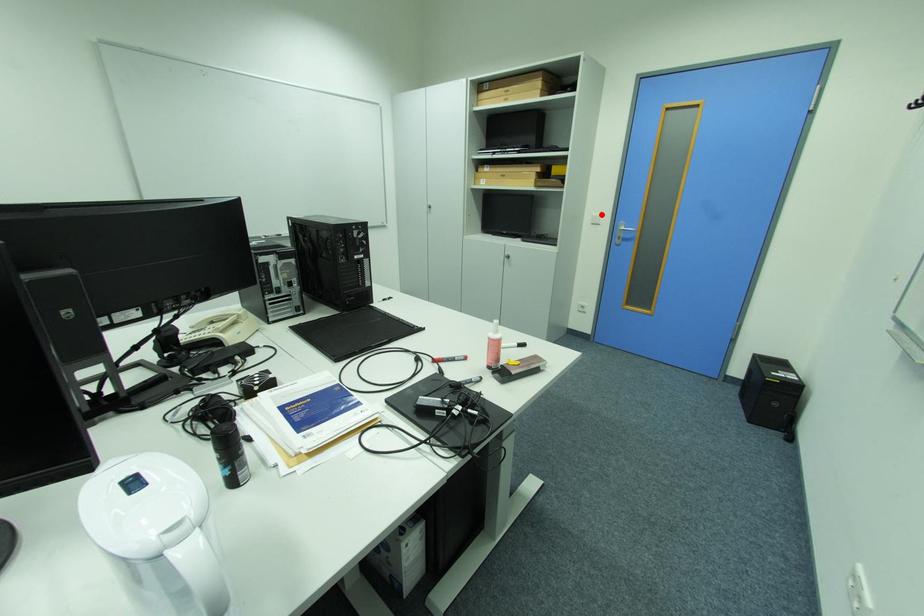
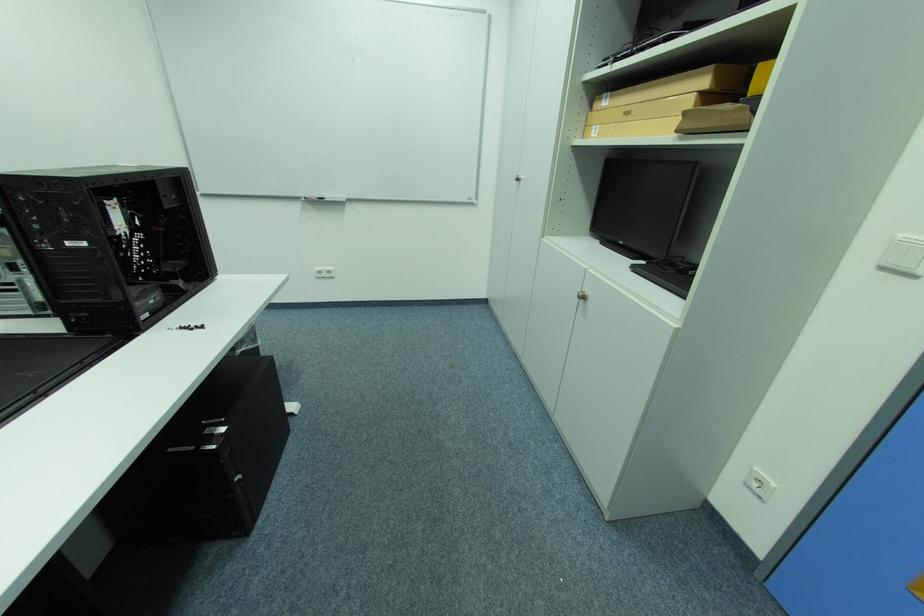
Locate, in the second image, the point that corresponds to the highlighted location in the first image.

(907, 236)